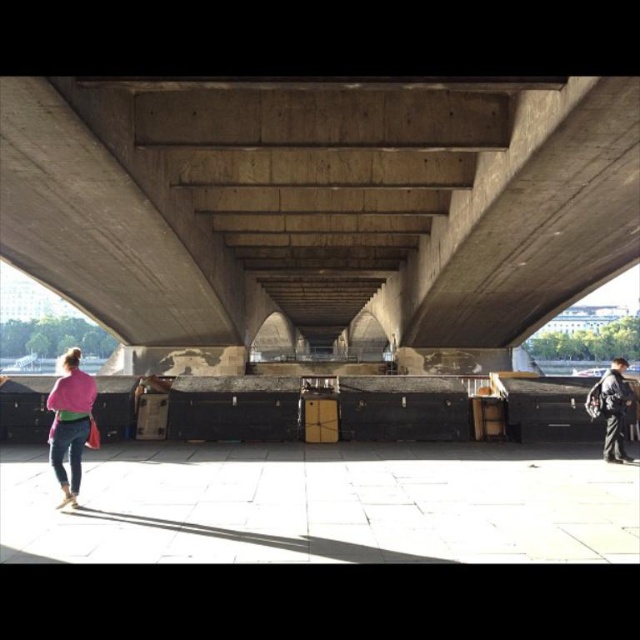
Question: Which point is farther to the camera?

Choices:
 (A) pyautogui.click(x=228, y=307)
 (B) pyautogui.click(x=618, y=435)

Answer: (A)

Question: Is concrete at center to the right of pink fabric at left from the viewer's perspective?

Choices:
 (A) no
 (B) yes

Answer: (B)

Question: Which of the following is the farthest from the observer?

Choices:
 (A) (621, 451)
 (B) (51, 394)
 (C) (67, 170)

Answer: (C)

Question: Is concrete at center wider than dark gray fabric jacket at lower right?

Choices:
 (A) yes
 (B) no

Answer: (A)

Question: Does concrete at center appear under pink fabric at left?

Choices:
 (A) no
 (B) yes

Answer: (A)

Question: Which object is the closest to the dark gray fabric jacket at lower right?

Choices:
 (A) pink fabric at left
 (B) concrete at center

Answer: (A)